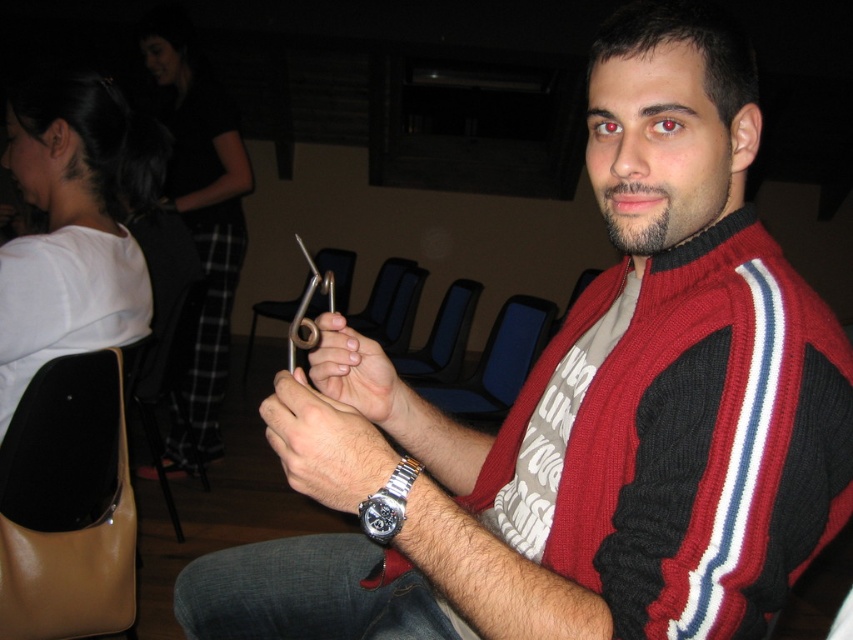
You are a designer creating a layout for a magazine cover. You need to place an image of the metallic silver watch at center and the black plastic chair at center such that the watch appears larger than the chair. Based on the scene description, is this possible?

The metallic silver watch at center is not as tall as the black plastic chair at center in the original scene, so it is not possible to make the watch appear larger than the chair in the magazine layout without altering the original proportions.

You are a delivery person who needs to place a 6 inch long package between the smooth metallic scissors at center and the silver metallic watch at center. Can you fit it there?

The distance between the smooth metallic scissors at center and the silver metallic watch at center is 5.94 inches, so the 6 inch long package cannot fit between them as it is slightly longer than the available space.

You are a photographer setting up a shoot in the scene. You need to adjust the lighting so that the metallic silver watch at center is fully visible without any obstruction from the black plastic chair at center. Is the current arrangement allowing this?

Yes, the metallic silver watch at center is in front of the black plastic chair at center, so it is not obstructed and fully visible.